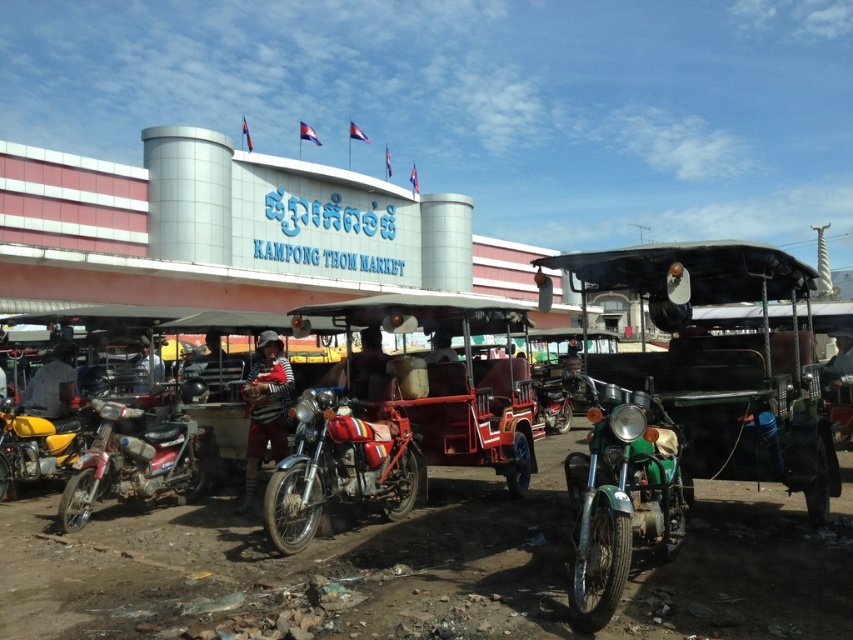
Is shiny red motorcycle at left closer to camera compared to striped fabric at center?

Yes, it is in front of striped fabric at center.

Is shiny red motorcycle at left to the right of striped fabric at center from the viewer's perspective?

No, shiny red motorcycle at left is not to the right of striped fabric at center.

Does point (117, 420) come behind point (281, 356)?

No, it is not.

The height and width of the screenshot is (640, 853). I want to click on shiny red motorcycle at left, so click(x=132, y=461).

Measure the distance between point (618, 442) and camera.

A distance of 4.88 meters exists between point (618, 442) and camera.

I want to click on green matte motorcycle at lower right, so click(x=619, y=497).

Is yellow matte motorcycle at lower left shorter than striped fabric at center?

Indeed, yellow matte motorcycle at lower left has a lesser height compared to striped fabric at center.

Between yellow matte motorcycle at lower left and striped fabric at center, which one is positioned lower?

Positioned lower is yellow matte motorcycle at lower left.

Who is more distant from viewer, [68,468] or [262,417]?

The point [68,468] is more distant.

Where is `yellow matte motorcycle at lower left`? Image resolution: width=853 pixels, height=640 pixels. yellow matte motorcycle at lower left is located at coordinates (39, 444).